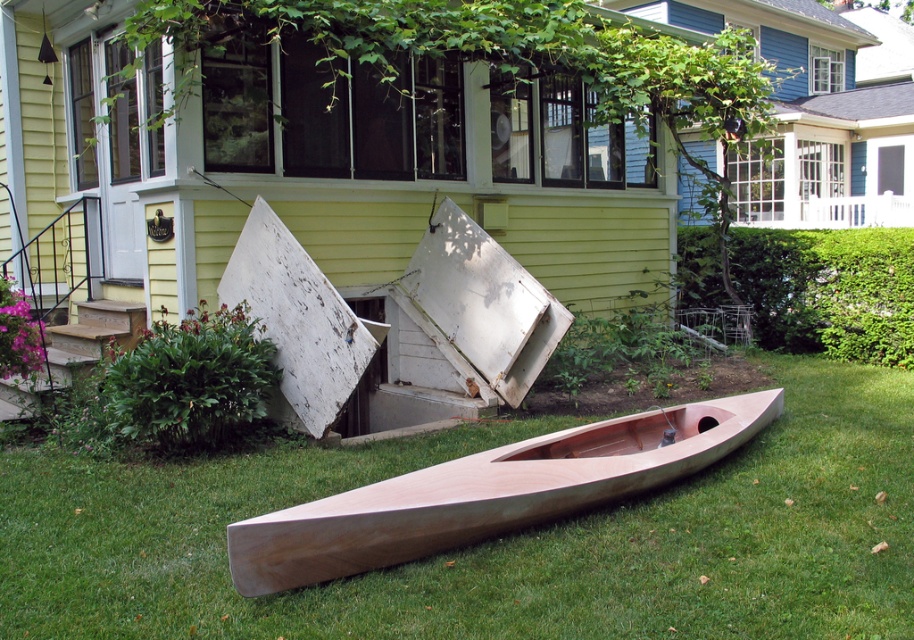
Question: Considering the relative positions of green grass at lower center and wooden canoe at center in the image provided, where is green grass at lower center located with respect to wooden canoe at center?

Choices:
 (A) below
 (B) above

Answer: (A)

Question: Is green grass at lower center to the right of wooden canoe at center from the viewer's perspective?

Choices:
 (A) yes
 (B) no

Answer: (A)

Question: Is green grass at lower center wider than wooden canoe at center?

Choices:
 (A) yes
 (B) no

Answer: (B)

Question: Which object is farther from the camera taking this photo?

Choices:
 (A) wooden canoe at center
 (B) green grass at lower center

Answer: (B)